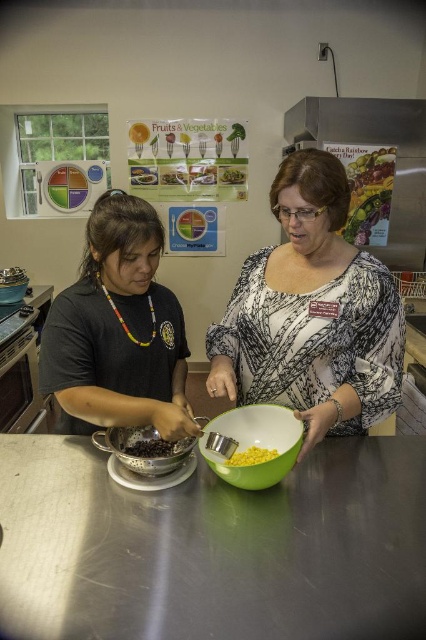
Between black matte shirt at left and green plastic bowl at center, which one is positioned lower?

green plastic bowl at center is lower down.

Can you confirm if black matte shirt at left is positioned above green plastic bowl at center?

Yes.

I want to click on black matte shirt at left, so pos(118,330).

Between black matte shirt at left and metallic silver bowl at center, which one is positioned higher?

black matte shirt at left is higher up.

What do you see at coordinates (118, 330) in the screenshot? This screenshot has width=426, height=640. I see `black matte shirt at left` at bounding box center [118, 330].

Does point (123, 259) lie behind point (169, 472)?

Yes, it is behind point (169, 472).

I want to click on black matte shirt at left, so click(118, 330).

Does point (66, 332) come farther from viewer compared to point (265, 458)?

That is True.

Is point (118, 253) behind point (253, 452)?

Yes, it is behind point (253, 452).

Image resolution: width=426 pixels, height=640 pixels. I want to click on black matte shirt at left, so click(118, 330).